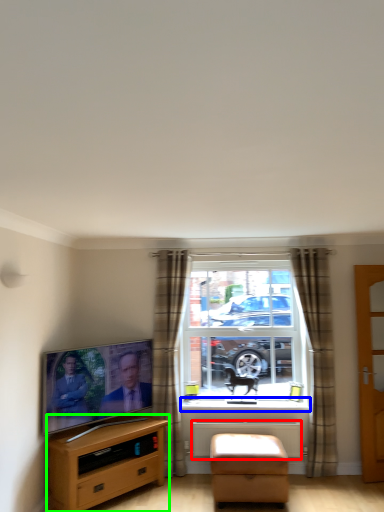
Question: Which object is positioned farthest from radiator (highlighted by a red box)? Select from window sill (highlighted by a blue box) and cabinetry (highlighted by a green box).

Choices:
 (A) window sill
 (B) cabinetry

Answer: (B)